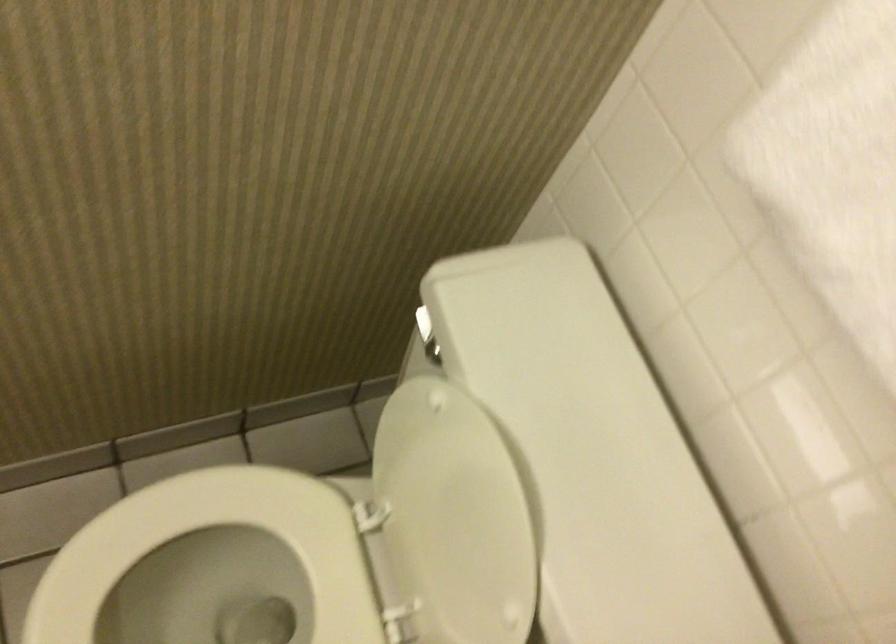
What are the coordinates of `toilet flush handle` in the screenshot? It's located at (423, 323).